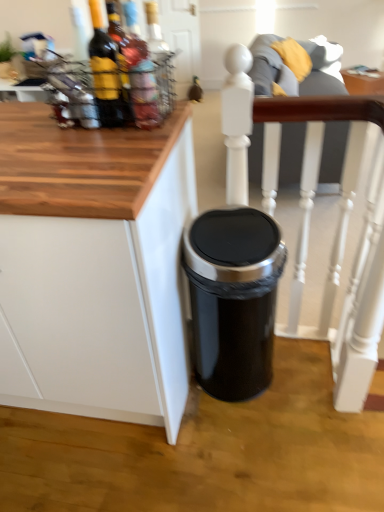
Question: Is translucent glass bottle at upper left, which ranks as the 1th bottle in right-to-left order, inside white painted wood chair at center?

Choices:
 (A) no
 (B) yes

Answer: (A)

Question: Can you confirm if white painted wood chair at center is bigger than translucent glass bottle at upper left, which ranks as the 1th bottle in right-to-left order?

Choices:
 (A) no
 (B) yes

Answer: (B)

Question: Can you confirm if white painted wood chair at center is taller than translucent glass bottle at upper left, which is the third bottle in left-to-right order?

Choices:
 (A) yes
 (B) no

Answer: (A)

Question: Is white painted wood chair at center far away from translucent glass bottle at upper left, which ranks as the 1th bottle in right-to-left order?

Choices:
 (A) yes
 (B) no

Answer: (B)

Question: Is white painted wood chair at center positioned before translucent glass bottle at upper left, which ranks as the 1th bottle in right-to-left order?

Choices:
 (A) yes
 (B) no

Answer: (B)

Question: Is white painted wood chair at center shorter than translucent glass bottle at upper left, which ranks as the 1th bottle in right-to-left order?

Choices:
 (A) yes
 (B) no

Answer: (B)

Question: Is translucent glass bottle at upper left, which is the third bottle in left-to-right order, not inside black metallic trash can at center?

Choices:
 (A) yes
 (B) no

Answer: (A)

Question: Is translucent glass bottle at upper left, which is the third bottle in left-to-right order, with black metallic trash can at center?

Choices:
 (A) yes
 (B) no

Answer: (B)

Question: Does translucent glass bottle at upper left, which ranks as the 1th bottle in right-to-left order, have a smaller size compared to black metallic trash can at center?

Choices:
 (A) yes
 (B) no

Answer: (A)

Question: Is black metallic trash can at center located within translucent glass bottle at upper left, which is the third bottle in left-to-right order?

Choices:
 (A) no
 (B) yes

Answer: (A)

Question: From the image's perspective, is translucent glass bottle at upper left, which ranks as the 1th bottle in right-to-left order, over black metallic trash can at center?

Choices:
 (A) yes
 (B) no

Answer: (A)

Question: From the image's perspective, is white matte cabinet at lower right located above black metallic trash can at center?

Choices:
 (A) no
 (B) yes

Answer: (B)